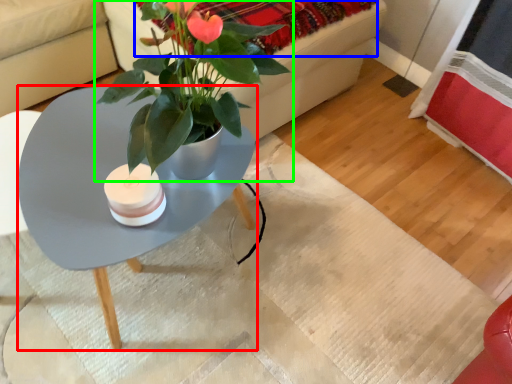
Question: Which is nearer to the coffee table (highlighted by a red box)? blanket (highlighted by a blue box) or houseplant (highlighted by a green box).

Choices:
 (A) blanket
 (B) houseplant

Answer: (B)